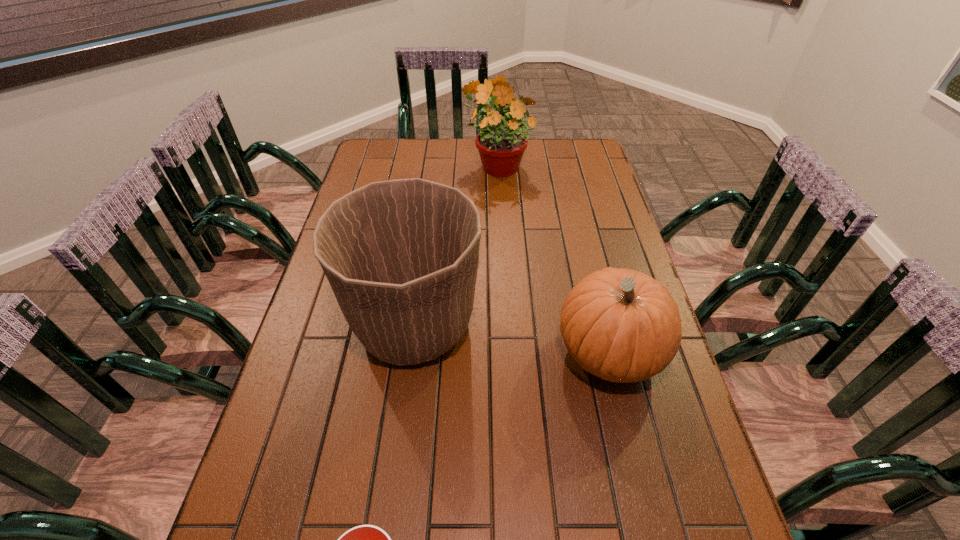
Where is `the farthest object`? This screenshot has height=540, width=960. the farthest object is located at coordinates (501, 143).

The image size is (960, 540). I want to click on the nearer flowerpot, so click(x=401, y=256).

The height and width of the screenshot is (540, 960). What are the coordinates of `the second shortest object` in the screenshot? It's located at (621, 325).

Locate an element on the screen. The image size is (960, 540). vacant region located on the left of the farthest object is located at coordinates (383, 164).

What are the coordinates of `vacant space located on the back of the nearer flowerpot` in the screenshot? It's located at (426, 234).

Locate an element on the screen. The width and height of the screenshot is (960, 540). free spot located on the stem of the second shortest object is located at coordinates (474, 352).

The height and width of the screenshot is (540, 960). Identify the location of free space located 0.400m on the stem of the second shortest object. (395, 352).

At what (x,y) coordinates should I click in order to perform the action: click on vacant space located 0.280m on the stem of the second shortest object. Please return your answer as a coordinate pair (x, y). This screenshot has height=540, width=960. Looking at the image, I should click on (443, 352).

Identify the location of object present at the far edge. The image size is (960, 540). (501, 143).

Where is `object at the left edge`? The image size is (960, 540). object at the left edge is located at coordinates (401, 256).